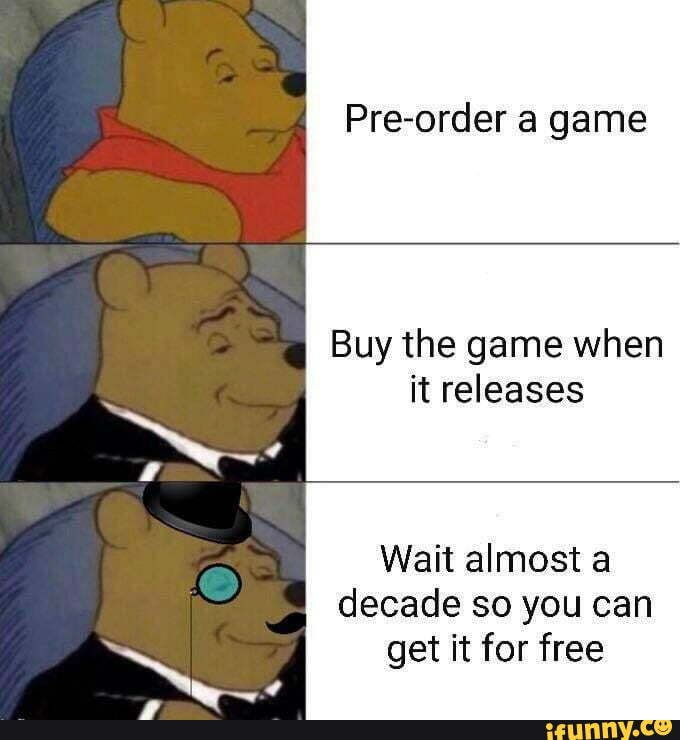
Locate an element on the screen. The image size is (680, 740). seat is located at coordinates (54, 567), (41, 374), (56, 132).